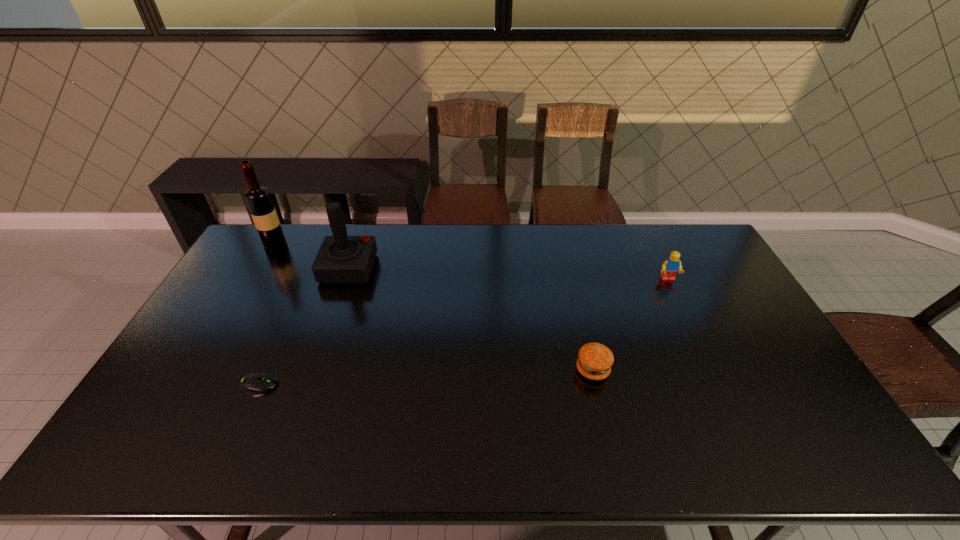
Where is `free space located 0.120m on the front-facing side of the Lego`? free space located 0.120m on the front-facing side of the Lego is located at coordinates (682, 308).

At what (x,y) coordinates should I click in order to perform the action: click on vacant region located on the right of the fourth object from left to right. Please return your answer as a coordinate pair (x, y). This screenshot has height=540, width=960. Looking at the image, I should click on (674, 370).

The height and width of the screenshot is (540, 960). I want to click on free space located on the wheel side of the shortest object, so click(319, 384).

Where is `wine bottle that is at the far edge`? The height and width of the screenshot is (540, 960). wine bottle that is at the far edge is located at coordinates (258, 198).

The width and height of the screenshot is (960, 540). I want to click on joystick located in the far edge section of the desktop, so click(341, 259).

Where is `object present at the left edge`? object present at the left edge is located at coordinates (258, 198).

This screenshot has width=960, height=540. Find the location of `object that is at the far left corner`. object that is at the far left corner is located at coordinates tap(258, 198).

Locate an element on the screen. Image resolution: width=960 pixels, height=540 pixels. vacant position at the far edge of the desktop is located at coordinates (599, 226).

This screenshot has width=960, height=540. In the image, there is a desktop. Identify the location of vacant space at the near edge. (336, 447).

Locate an element on the screen. The width and height of the screenshot is (960, 540). vacant space at the left edge of the desktop is located at coordinates (175, 395).